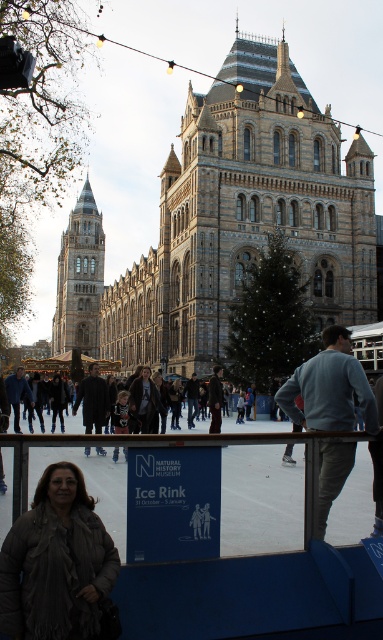
You are standing on the ice rink and want to take a photo of both the brown stone tower at center and the golden stone tower at left. Which tower should you position closer to the camera to include both in the frame?

You should position the brown stone tower at center closer to the camera because it is already closer to the viewer than the golden stone tower at left, so adjusting your position to focus on it will help capture both in the frame.

You are standing at the entrance of the Natural History Museum and want to find the person wearing the brown fuzzy coat at lower left. According to the coordinates given, where should you look to find them?

The brown fuzzy coat at lower left is located at coordinates point (57, 563), so you should look towards the lower left area near those coordinates to find them.

You are planning to take a photo of the brown stone tower at center and the golden stone tower at left from a distance where both can be fully captured in the frame. Given that your camera has a maximum focal length that allows capturing objects up to 100 meters apart in the same frame, will you be able to include both towers in a single photo?

The brown stone tower at center and golden stone tower at left are 91.10 meters apart. Since your camera can capture objects up to 100 meters apart, you can include both towers in a single photo as the distance between them is within the camera range.